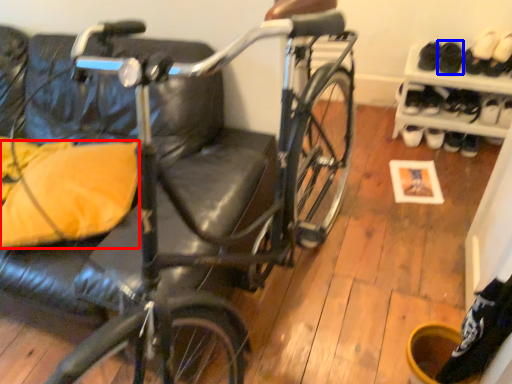
Question: Among these objects, which one is nearest to the camera, pillow (highlighted by a red box) or footwear (highlighted by a blue box)?

Choices:
 (A) pillow
 (B) footwear

Answer: (A)